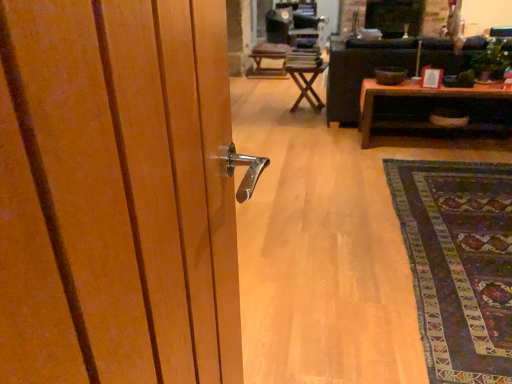
Question: Would you say dark purple woven rug at lower right is part of brown wooden table at center, which is the 1th table in front-to-back order,'s contents?

Choices:
 (A) no
 (B) yes

Answer: (A)

Question: From the image's perspective, is brown wooden table at center, which is the 1th table in front-to-back order, on dark purple woven rug at lower right?

Choices:
 (A) no
 (B) yes

Answer: (B)

Question: Considering the relative positions of brown wooden table at center, marked as the first table in a right-to-left arrangement, and dark purple woven rug at lower right in the image provided, is brown wooden table at center, marked as the first table in a right-to-left arrangement, in front of dark purple woven rug at lower right?

Choices:
 (A) no
 (B) yes

Answer: (A)

Question: Is brown wooden table at center, which is the 2th table from left to right, to the left of dark purple woven rug at lower right from the viewer's perspective?

Choices:
 (A) yes
 (B) no

Answer: (B)

Question: From a real-world perspective, does brown wooden table at center, which is the 1th table in front-to-back order, sit lower than dark purple woven rug at lower right?

Choices:
 (A) yes
 (B) no

Answer: (B)

Question: From the image's perspective, is brown wooden table at center, which is the 2th table from left to right, located beneath dark purple woven rug at lower right?

Choices:
 (A) no
 (B) yes

Answer: (A)

Question: Is black leather couch at center facing towards wooden chair at center?

Choices:
 (A) yes
 (B) no

Answer: (A)

Question: Can you confirm if black leather couch at center is taller than wooden chair at center?

Choices:
 (A) yes
 (B) no

Answer: (A)

Question: Is black leather couch at center further to the viewer compared to wooden chair at center?

Choices:
 (A) no
 (B) yes

Answer: (A)

Question: Is black leather couch at center next to wooden chair at center and touching it?

Choices:
 (A) no
 (B) yes

Answer: (A)

Question: From the image's perspective, would you say black leather couch at center is shown under wooden chair at center?

Choices:
 (A) no
 (B) yes

Answer: (B)

Question: Can you confirm if black leather couch at center is shorter than wooden chair at center?

Choices:
 (A) no
 (B) yes

Answer: (A)

Question: From a real-world perspective, is wooden chair at center physically above wooden table at center, marked as the first table in a left-to-right arrangement?

Choices:
 (A) yes
 (B) no

Answer: (B)